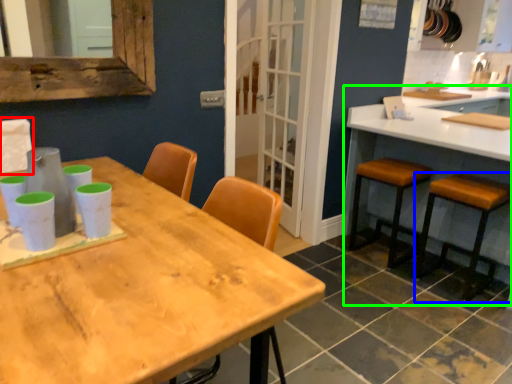
Question: Estimate the real-world distances between objects in this image. Which object is closer to chair (highlighted by a red box), stool (highlighted by a blue box) or counter (highlighted by a green box)?

Choices:
 (A) stool
 (B) counter

Answer: (A)